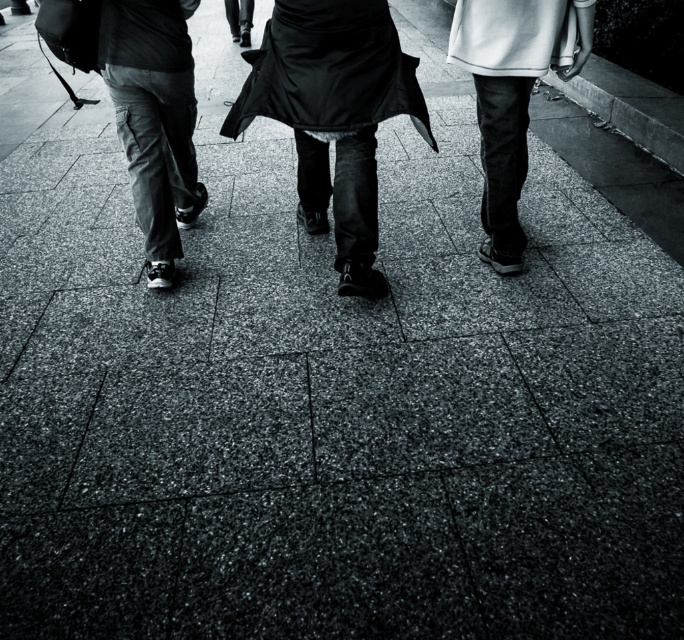
You are a photographer trying to capture a photo of the dark gray cargo pants at left and the smooth black pants at right. Since you want to focus on the details of the clothing, which one should you zoom in on to ensure it fills the frame more without moving the camera?

The smooth black pants at right should be zoomed in on because they are wider than the dark gray cargo pants at left, so they will fill the frame more when zoomed in.

You are a photographer standing at the camera position. You want to capture a photo of the matte black skirt at center and dark gray cargo pants at left. Can you fit both subjects into a frame that can only accommodate objects within 24 inches of each other?

The distance between the matte black skirt at center and dark gray cargo pants at left is 23.03 inches, which is within the 24 inches limit. Therefore, both subjects can be captured in the frame.

You are observing three people walking away from you on the pavement. You notice dark gray cargo pants at left and matte black skirt at center. Which of these two items of clothing is positioned to the right?

The matte black skirt at center is positioned to the right of the dark gray cargo pants at left.